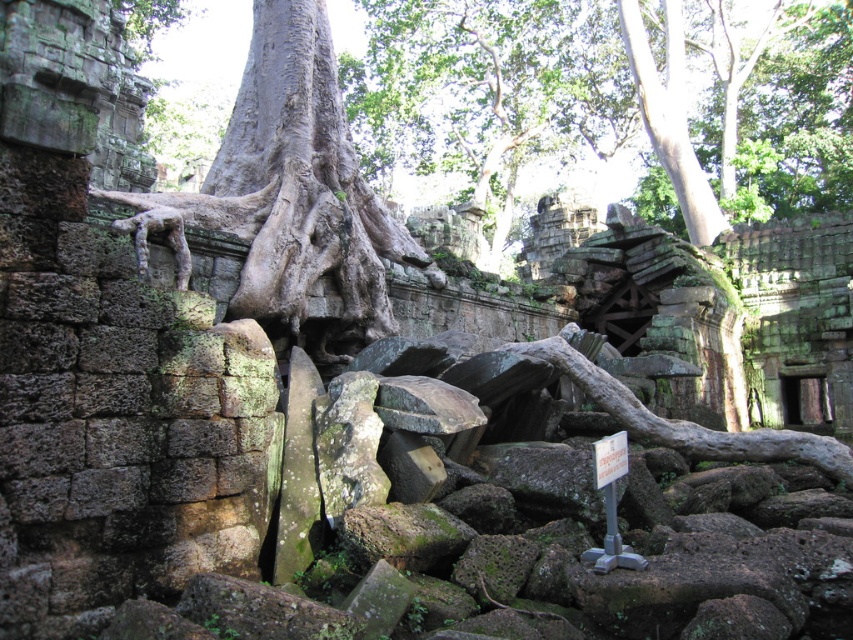
Question: Which point is farther to the camera?

Choices:
 (A) (630, 433)
 (B) (703, 225)

Answer: (B)

Question: Which of the following is the closest to the observer?

Choices:
 (A) (619, 384)
 (B) (753, 88)

Answer: (A)

Question: Which point is farther to the camera?

Choices:
 (A) smooth gray bark at upper right
 (B) green mossy stone at upper center
 (C) green mossy wood at center

Answer: (B)

Question: Is gray rough stone tree trunk at center wider than green mossy wood at center?

Choices:
 (A) yes
 (B) no

Answer: (B)

Question: Does green mossy stone at upper center appear under gray rough stone tree trunk at center?

Choices:
 (A) no
 (B) yes

Answer: (A)

Question: Does gray rough stone tree trunk at center have a greater width compared to green mossy wood at center?

Choices:
 (A) no
 (B) yes

Answer: (A)